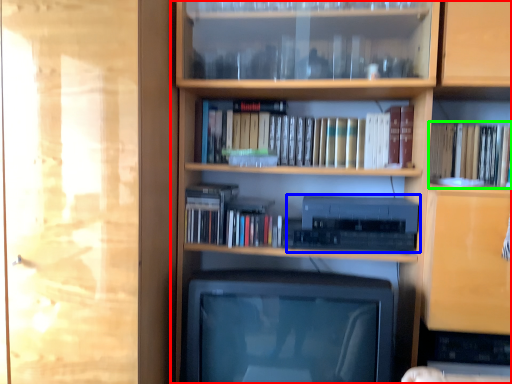
Question: Which is nearer to the bookcase (highlighted by a red box)? stereo (highlighted by a blue box) or book (highlighted by a green box).

Choices:
 (A) stereo
 (B) book

Answer: (A)